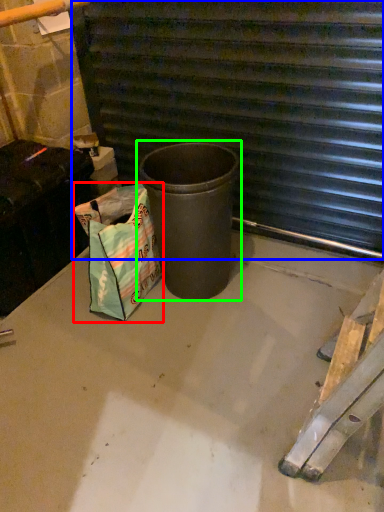
Question: Which object is positioned closest to shopping bag (highlighted by a red box)? Select from stairwell (highlighted by a blue box) and waste container (highlighted by a green box).

Choices:
 (A) stairwell
 (B) waste container

Answer: (B)